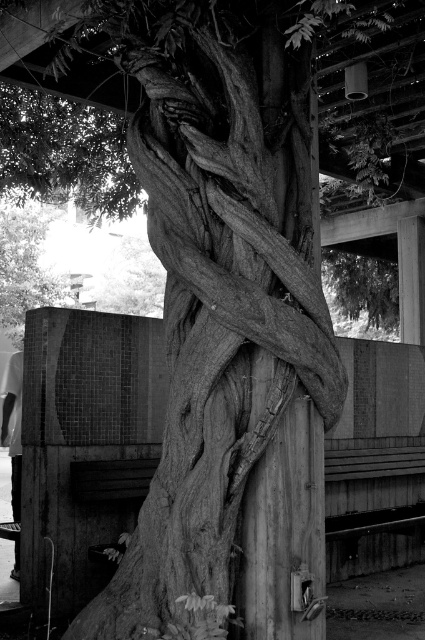
You are a photographer trying to capture the entire wooden textured tree trunk at center and the white fabric shirt at lower left in a single frame. Given their sizes, which object will require you to step back further to include both in your shot?

The wooden textured tree trunk at center is larger in size than the white fabric shirt at lower left, so you will need to step back further to include both in your shot to accommodate the larger size of the wooden textured tree trunk at center.

You are standing in front of the tree and want to hang a small decoration on the wooden textured tree trunk at upper left. However, you notice the white fabric shirt at lower left nearby. Considering their heights, which object is more likely to be within your reach without needing a ladder?

The white fabric shirt at lower left is shorter than the wooden textured tree trunk at upper left, so it would be within easier reach without needing a ladder.